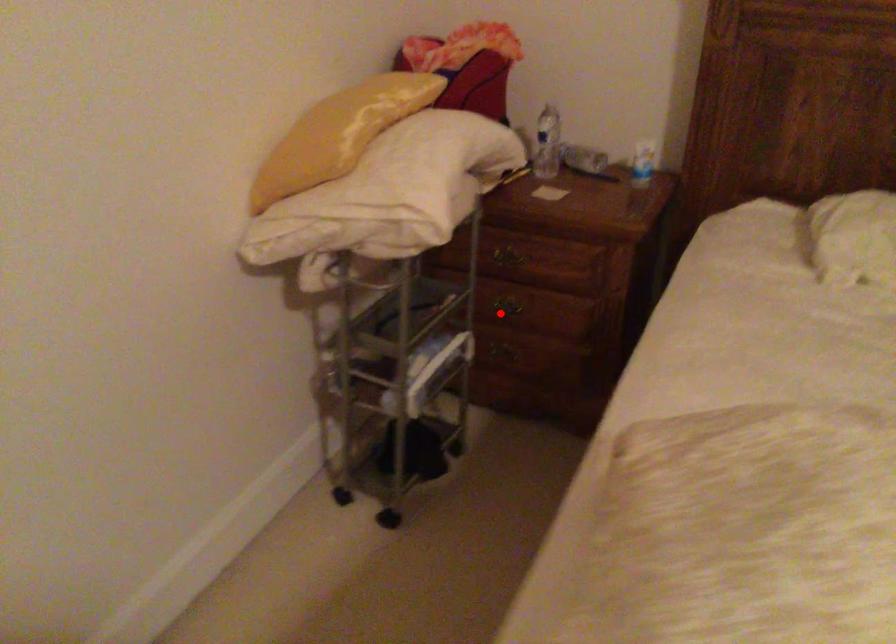
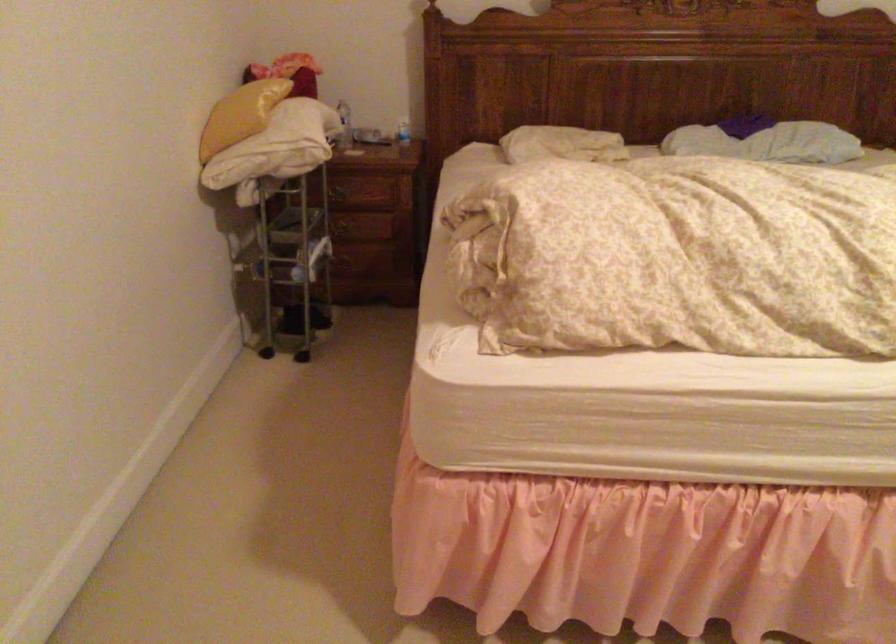
The point at the highlighted location is marked in the first image. Where is the corresponding point in the second image?

(342, 230)